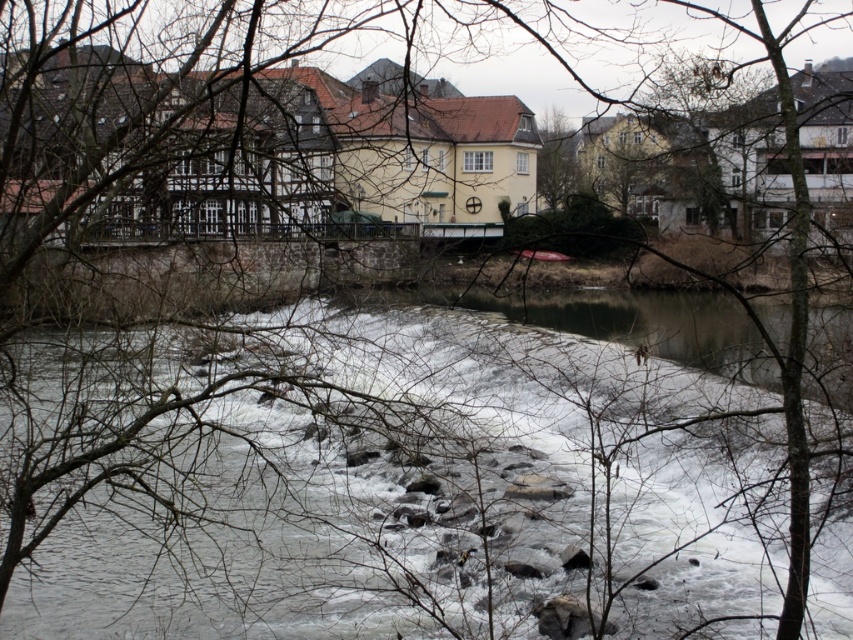
Which is in front, point (210, 524) or point (558, 205)?

Point (210, 524)

At what (x,y) coordinates should I click in order to perform the action: click on white frothy water at center. Please return your answer as a coordinate pair (x, y). Looking at the image, I should click on (381, 483).